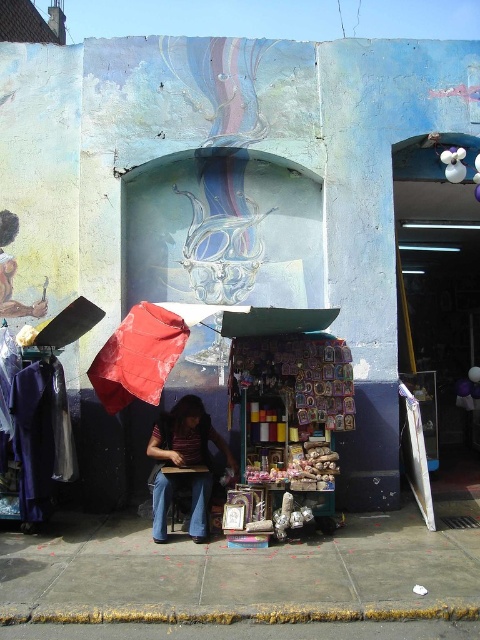
You are standing in front of the stall and want to place a small decoration between the two points, point (123, 392) and point (181, 464). Which point is closer to you so you can start placing the decoration there?

Point (123, 392) is closer to you, so you should start placing the decoration there first.

You are standing on the concrete sidewalk at center. If you look directly ahead, which direction would you be facing relative to the wall with the mural?

Since the concrete sidewalk at center is positioned in front of the wall with the mural, facing directly ahead from the sidewalk would mean you are facing toward the wall with the mural.

You are walking along the street and want to step onto the concrete curb at lower center from the concrete sidewalk at center. Which direction should you move to reach the curb?

The concrete sidewalk at center is to the right of the concrete curb at lower center, so you should move to the left to reach the curb.